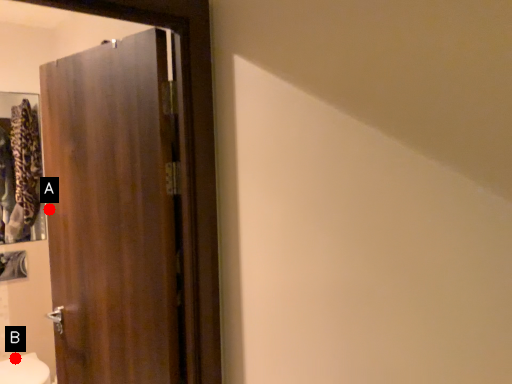
Question: Two points are circled on the image, labeled by A and B beside each circle. Which point is closer to the camera?

Choices:
 (A) A is closer
 (B) B is closer

Answer: (A)